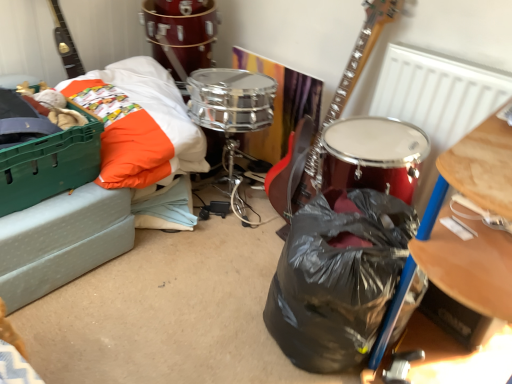
The width and height of the screenshot is (512, 384). What do you see at coordinates (102, 186) in the screenshot? I see `green plastic crate at left` at bounding box center [102, 186].

Locate an element on the screen. The height and width of the screenshot is (384, 512). black plastic bag at center is located at coordinates (338, 277).

Locate an element on the screen. The width and height of the screenshot is (512, 384). green plastic crate at left is located at coordinates (102, 186).

From a real-world perspective, is shiny metallic drum at upper center below black plastic bag at center?

No, from a real-world perspective, shiny metallic drum at upper center is not below black plastic bag at center.

From the image's perspective, is shiny metallic drum at upper center on black plastic bag at center?

Yes, from the image's perspective, shiny metallic drum at upper center is on top of black plastic bag at center.

Consider the image. Is shiny metallic drum at upper center shorter than black plastic bag at center?

Indeed, shiny metallic drum at upper center has a lesser height compared to black plastic bag at center.

Which object is positioned more to the left, shiny metallic drum at upper center or black plastic bag at center?

From the viewer's perspective, shiny metallic drum at upper center appears more on the left side.

Is black plastic bag at center not close to shiny metallic drum at upper center?

Yes, black plastic bag at center and shiny metallic drum at upper center are quite far apart.

Considering their positions, is black plastic bag at center located in front of or behind shiny metallic drum at upper center?

Clearly, black plastic bag at center is in front of shiny metallic drum at upper center.

Is shiny metallic drum at upper center completely or partially inside black plastic bag at center?

That's incorrect, shiny metallic drum at upper center is not inside black plastic bag at center.

Where is `garbage on the right of the shiny metallic drum at upper center`? garbage on the right of the shiny metallic drum at upper center is located at coordinates (338, 277).

Does point (126, 117) come in front of point (319, 324)?

No, (126, 117) is further to viewer.

Could you tell me if green plastic crate at left is turned towards black plastic bag at center?

Yes, green plastic crate at left is facing black plastic bag at center.

How many degrees apart are the facing directions of green plastic crate at left and black plastic bag at center?

The angular difference between green plastic crate at left and black plastic bag at center is 84.6 degrees.

Considering the positions of objects green plastic crate at left and black plastic bag at center in the image provided, who is more to the right, green plastic crate at left or black plastic bag at center?

black plastic bag at center.

From a real-world perspective, is shiny metallic drum at upper center physically located above or below green plastic crate at left?

From a real-world perspective, shiny metallic drum at upper center is physically above green plastic crate at left.

Relative to green plastic crate at left, is shiny metallic drum at upper center in front or behind?

shiny metallic drum at upper center is behind green plastic crate at left.

From the image's perspective, is shiny metallic drum at upper center under green plastic crate at left?

No, from the image's perspective, shiny metallic drum at upper center is not below green plastic crate at left.

Is point (184, 54) more distant than point (164, 153)?

Yes, point (184, 54) is behind point (164, 153).

Which is nearer, (330, 368) or (32, 290)?

Point (330, 368)

Is black plastic bag at center wider or thinner than green plastic crate at left?

In the image, black plastic bag at center appears to be more narrow than green plastic crate at left.

Can you tell me how much black plastic bag at center and green plastic crate at left differ in facing direction?

They differ by 84.6 degrees in their facing directions.

Is the depth of black plastic bag at center greater than that of green plastic crate at left?

No.

Are green plastic crate at left and shiny metallic drum at upper center located far from each other?

No, green plastic crate at left is not far from shiny metallic drum at upper center.

Which point is more distant from viewer, (112, 80) or (164, 36)?

Point (164, 36)

Is green plastic crate at left surrounding shiny metallic drum at upper center?

Actually, shiny metallic drum at upper center is outside green plastic crate at left.

Where is `drum lying above the black plastic bag at center (from the image's perspective)`? This screenshot has height=384, width=512. drum lying above the black plastic bag at center (from the image's perspective) is located at coordinates [181, 38].

There is a black plastic bag at center. Where is `drum above it (from a real-world perspective)`? drum above it (from a real-world perspective) is located at coordinates (181, 38).

When comparing their distances from green plastic crate at left, does black plastic bag at center or shiny metallic drum at upper center seem further?

The object further to green plastic crate at left is black plastic bag at center.

Which object lies further to the anchor point black plastic bag at center, green plastic crate at left or shiny metallic drum at upper center?

shiny metallic drum at upper center lies further to black plastic bag at center than the other object.

Looking at the image, which one is located further to shiny metallic drum at upper center, green plastic crate at left or black plastic bag at center?

black plastic bag at center is positioned further to the anchor shiny metallic drum at upper center.

When comparing their distances from green plastic crate at left, does shiny metallic drum at upper center or black plastic bag at center seem further?

Based on the image, black plastic bag at center appears to be further to green plastic crate at left.

Which object lies nearer to the anchor point shiny metallic drum at upper center, black plastic bag at center or green plastic crate at left?

Among the two, green plastic crate at left is located nearer to shiny metallic drum at upper center.

From the image, which object appears to be farther from black plastic bag at center, shiny metallic drum at upper center or green plastic crate at left?

shiny metallic drum at upper center is positioned further to the anchor black plastic bag at center.

This screenshot has width=512, height=384. What are the coordinates of `couch between shiny metallic drum at upper center and black plastic bag at center vertically` in the screenshot? It's located at (102, 186).